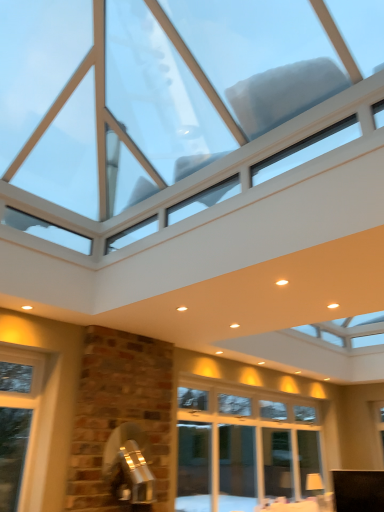
The image size is (384, 512). What do you see at coordinates (183, 108) in the screenshot?
I see `transparent glass window at upper center` at bounding box center [183, 108].

Locate an element on the screen. The height and width of the screenshot is (512, 384). transparent glass window at upper center is located at coordinates (183, 108).

Locate an element on the screen. black fabric cabinet at lower right is located at coordinates (358, 490).

What do you see at coordinates (358, 490) in the screenshot? I see `black fabric cabinet at lower right` at bounding box center [358, 490].

Locate an element on the screen. transparent glass window at upper center is located at coordinates (183, 108).

Is black fabric cabinet at lower right at the right side of transparent glass window at upper center?

Yes.

Which object is further away from the camera, black fabric cabinet at lower right or transparent glass window at upper center?

black fabric cabinet at lower right.

Is point (360, 474) closer or farther from the camera than point (94, 202)?

Point (360, 474) is positioned farther from the camera compared to point (94, 202).

From the image's perspective, is black fabric cabinet at lower right above or below transparent glass window at upper center?

Clearly, from the image's perspective, black fabric cabinet at lower right is below transparent glass window at upper center.

From a real-world perspective, is black fabric cabinet at lower right above or below transparent glass window at upper center?

Clearly, from a real-world perspective, black fabric cabinet at lower right is below transparent glass window at upper center.

Does black fabric cabinet at lower right have a lesser width compared to transparent glass window at upper center?

Indeed, black fabric cabinet at lower right has a lesser width compared to transparent glass window at upper center.

Considering the relative sizes of black fabric cabinet at lower right and transparent glass window at upper center in the image provided, is black fabric cabinet at lower right taller than transparent glass window at upper center?

No, black fabric cabinet at lower right is not taller than transparent glass window at upper center.

Can you confirm if black fabric cabinet at lower right is bigger than transparent glass window at upper center?

Actually, black fabric cabinet at lower right might be smaller than transparent glass window at upper center.

Which is correct: black fabric cabinet at lower right is inside transparent glass window at upper center, or outside of it?

black fabric cabinet at lower right is spatially situated outside transparent glass window at upper center.

Are black fabric cabinet at lower right and transparent glass window at upper center located far from each other?

black fabric cabinet at lower right is positioned a significant distance from transparent glass window at upper center.

Is black fabric cabinet at lower right aimed at transparent glass window at upper center?

No, black fabric cabinet at lower right is not aimed at transparent glass window at upper center.

The width and height of the screenshot is (384, 512). Identify the location of window above the black fabric cabinet at lower right (from a real-world perspective). pos(183,108).

Considering the relative positions of transparent glass window at upper center and black fabric cabinet at lower right in the image provided, is transparent glass window at upper center to the left or to the right of black fabric cabinet at lower right?

transparent glass window at upper center is to the left of black fabric cabinet at lower right.

Considering the positions of objects transparent glass window at upper center and black fabric cabinet at lower right in the image provided, who is in front, transparent glass window at upper center or black fabric cabinet at lower right?

transparent glass window at upper center.

Considering the points (172, 130) and (381, 509), which point is in front, point (172, 130) or point (381, 509)?

The point (172, 130) is closer.

From the image's perspective, between transparent glass window at upper center and black fabric cabinet at lower right, who is located below?

black fabric cabinet at lower right, from the image's perspective.

From a real-world perspective, which object rests below the other?

From a 3D spatial view, black fabric cabinet at lower right is below.

In terms of width, does transparent glass window at upper center look wider or thinner when compared to black fabric cabinet at lower right?

Clearly, transparent glass window at upper center has more width compared to black fabric cabinet at lower right.

Considering the relative sizes of transparent glass window at upper center and black fabric cabinet at lower right in the image provided, is transparent glass window at upper center shorter than black fabric cabinet at lower right?

Incorrect, the height of transparent glass window at upper center does not fall short of that of black fabric cabinet at lower right.

From the picture: Considering the sizes of objects transparent glass window at upper center and black fabric cabinet at lower right in the image provided, who is smaller, transparent glass window at upper center or black fabric cabinet at lower right?

black fabric cabinet at lower right is smaller.

Can black fabric cabinet at lower right be found inside transparent glass window at upper center?

That's incorrect, black fabric cabinet at lower right is not inside transparent glass window at upper center.

Is transparent glass window at upper center next to black fabric cabinet at lower right?

There is a gap between transparent glass window at upper center and black fabric cabinet at lower right.

Is black fabric cabinet at lower right at the back of transparent glass window at upper center?

transparent glass window at upper center is not turned away from black fabric cabinet at lower right.

How many degrees apart are the facing directions of transparent glass window at upper center and black fabric cabinet at lower right?

There is a 49-degree angle between the facing directions of transparent glass window at upper center and black fabric cabinet at lower right.

Where is `furniture behind the transparent glass window at upper center`? The height and width of the screenshot is (512, 384). furniture behind the transparent glass window at upper center is located at coordinates [358, 490].

Locate an element on the screen. Image resolution: width=384 pixels, height=512 pixels. window in front of the black fabric cabinet at lower right is located at coordinates (183, 108).

I want to click on furniture below the transparent glass window at upper center (from a real-world perspective), so tap(358, 490).